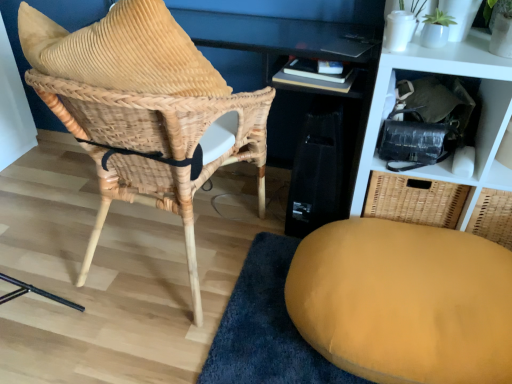
Question: Could you tell me if woven wicker basket at upper right is turned towards velvet yellow ottoman at lower right?

Choices:
 (A) yes
 (B) no

Answer: (A)

Question: From the image's perspective, is woven wicker basket at upper right above velvet yellow ottoman at lower right?

Choices:
 (A) no
 (B) yes

Answer: (B)

Question: Is woven wicker basket at upper right bigger than velvet yellow ottoman at lower right?

Choices:
 (A) yes
 (B) no

Answer: (A)

Question: Does woven wicker basket at upper right have a smaller size compared to velvet yellow ottoman at lower right?

Choices:
 (A) no
 (B) yes

Answer: (A)

Question: Considering the relative sizes of woven wicker basket at upper right and velvet yellow ottoman at lower right in the image provided, is woven wicker basket at upper right taller than velvet yellow ottoman at lower right?

Choices:
 (A) yes
 (B) no

Answer: (A)

Question: Is woven wicker basket at upper right positioned behind velvet yellow ottoman at lower right?

Choices:
 (A) no
 (B) yes

Answer: (B)

Question: Considering the relative sizes of velvet yellow ottoman at lower right and woven rattan chair at left in the image provided, is velvet yellow ottoman at lower right taller than woven rattan chair at left?

Choices:
 (A) yes
 (B) no

Answer: (B)

Question: Considering the relative sizes of velvet yellow ottoman at lower right and woven rattan chair at left in the image provided, is velvet yellow ottoman at lower right smaller than woven rattan chair at left?

Choices:
 (A) no
 (B) yes

Answer: (B)

Question: Is the depth of velvet yellow ottoman at lower right less than that of woven rattan chair at left?

Choices:
 (A) yes
 (B) no

Answer: (B)

Question: Is velvet yellow ottoman at lower right at the left side of woven rattan chair at left?

Choices:
 (A) yes
 (B) no

Answer: (B)

Question: From a real-world perspective, is velvet yellow ottoman at lower right located beneath woven rattan chair at left?

Choices:
 (A) no
 (B) yes

Answer: (B)

Question: Is velvet yellow ottoman at lower right wider than woven rattan chair at left?

Choices:
 (A) yes
 (B) no

Answer: (A)

Question: Does woven rattan chair at left have a smaller size compared to woven wicker basket at upper right?

Choices:
 (A) yes
 (B) no

Answer: (B)